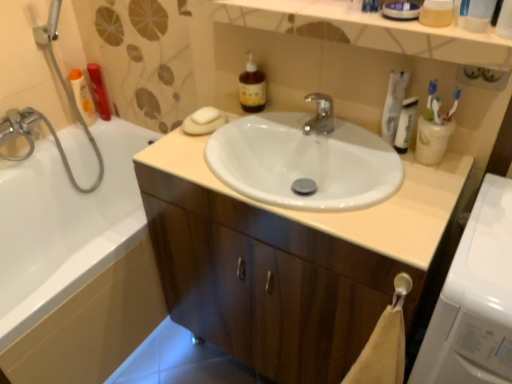
Identify the location of unoccupied area in front of white plastic tube at upper right, which appears as the 1th mouthwash when viewed from the right. (412, 191).